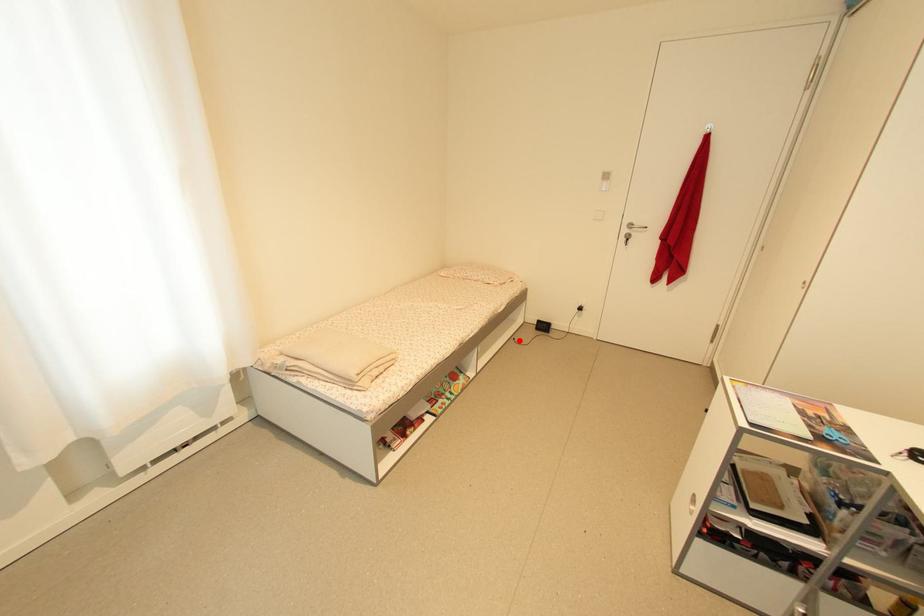
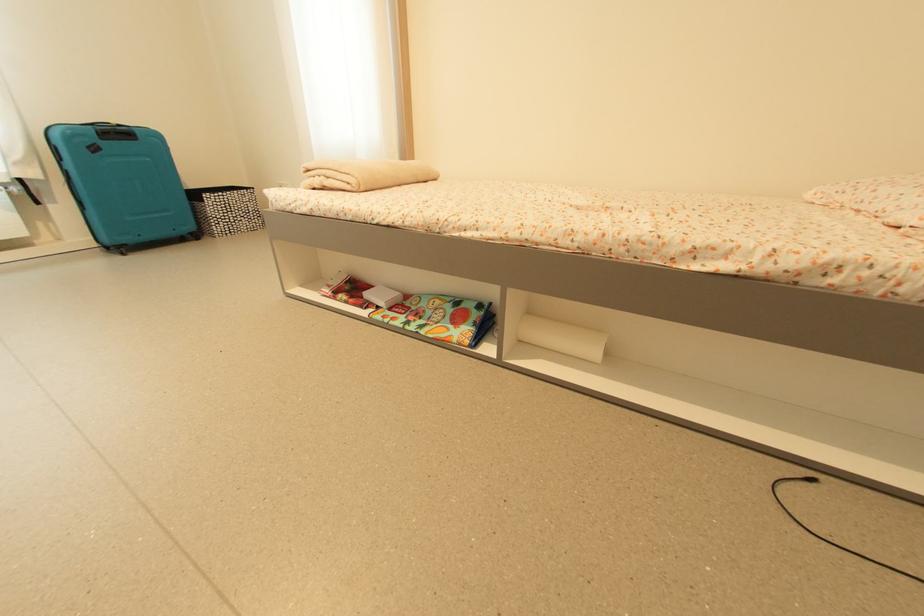
In the second image, find the point that corresponds to the highlighted location in the first image.

(817, 483)